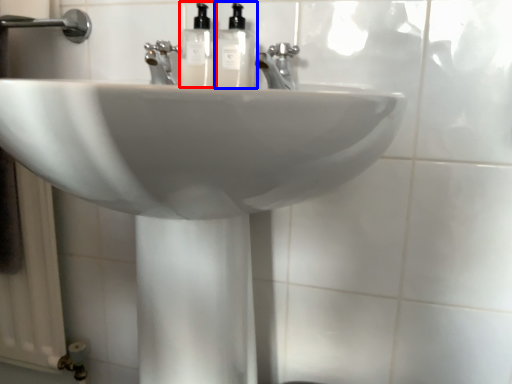
Question: Which object appears farthest to the camera in this image, soap dispenser (highlighted by a red box) or soap dispenser (highlighted by a blue box)?

Choices:
 (A) soap dispenser
 (B) soap dispenser

Answer: (A)